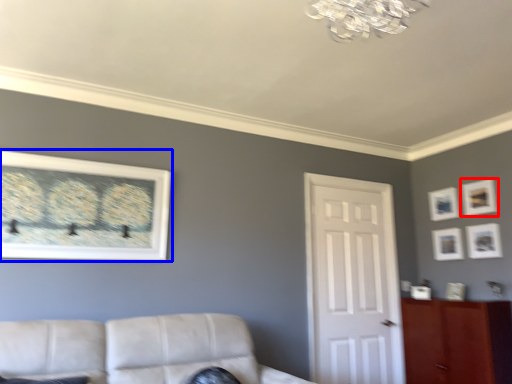
Question: Which object is closer to the camera taking this photo, picture frame (highlighted by a red box) or picture frame (highlighted by a blue box)?

Choices:
 (A) picture frame
 (B) picture frame

Answer: (B)